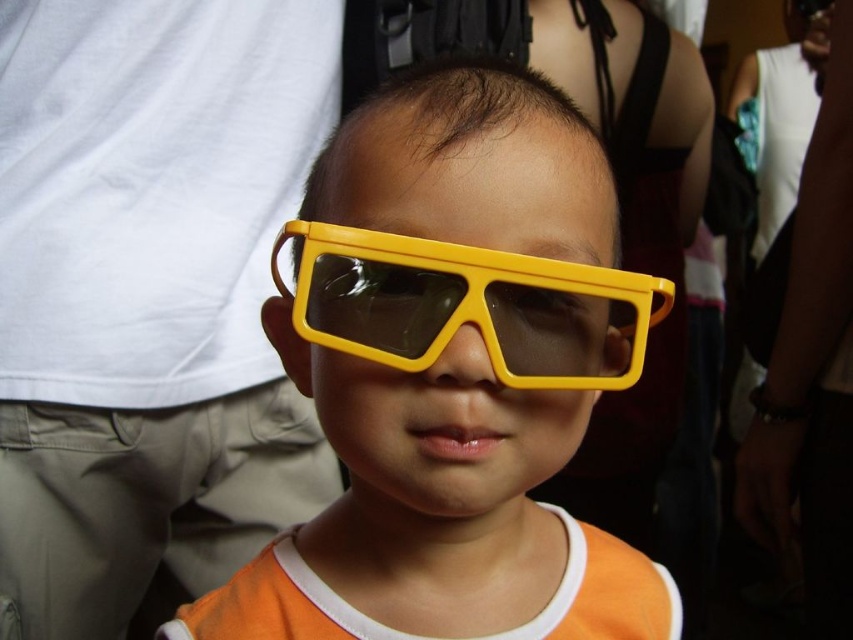
Question: Is yellow plastic glasses at center bigger than yellow plastic goggles at center?

Choices:
 (A) yes
 (B) no

Answer: (A)

Question: Where is yellow plastic glasses at center located in relation to yellow plastic goggles at center in the image?

Choices:
 (A) left
 (B) right

Answer: (A)

Question: Which object is closer to the camera taking this photo?

Choices:
 (A) yellow plastic glasses at center
 (B) yellow plastic goggles at center

Answer: (A)

Question: Which point is farther to the camera?

Choices:
 (A) (397, 369)
 (B) (509, 282)

Answer: (A)

Question: Is yellow plastic glasses at center thinner than yellow plastic goggles at center?

Choices:
 (A) yes
 (B) no

Answer: (B)